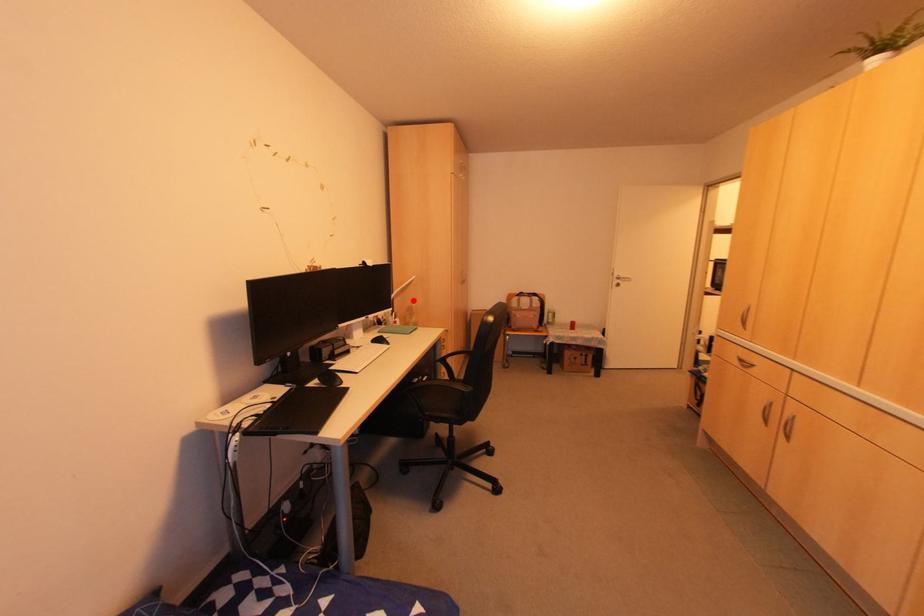
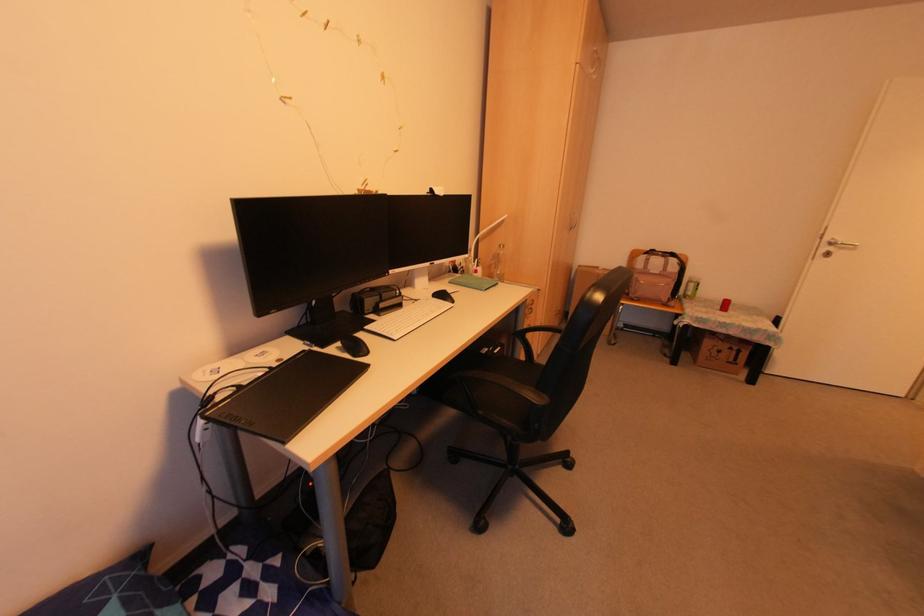
Question: A red point is marked in image1. In image2, is the corresponding 3D point closer to the camera or farther? Reply with the corresponding letter.

Choices:
 (A) The corresponding 3D point is closer.
 (B) The corresponding 3D point is farther.

Answer: (A)